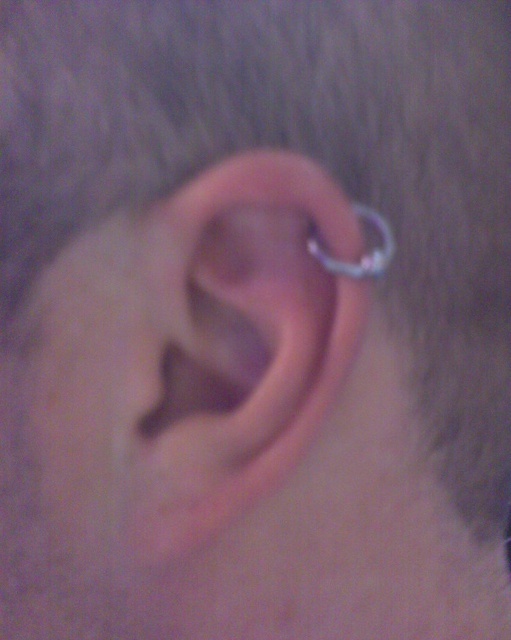
You are a photographer adjusting the lighting for a closeup shot of an ear. You notice a point marked at coordinates (x=243, y=337). Based on the scene description, what color is the area around this point likely to be?

The point (x=243, y=337) marks the pink flesh colored ear at center, so the area around this point is likely to be pink flesh colored.